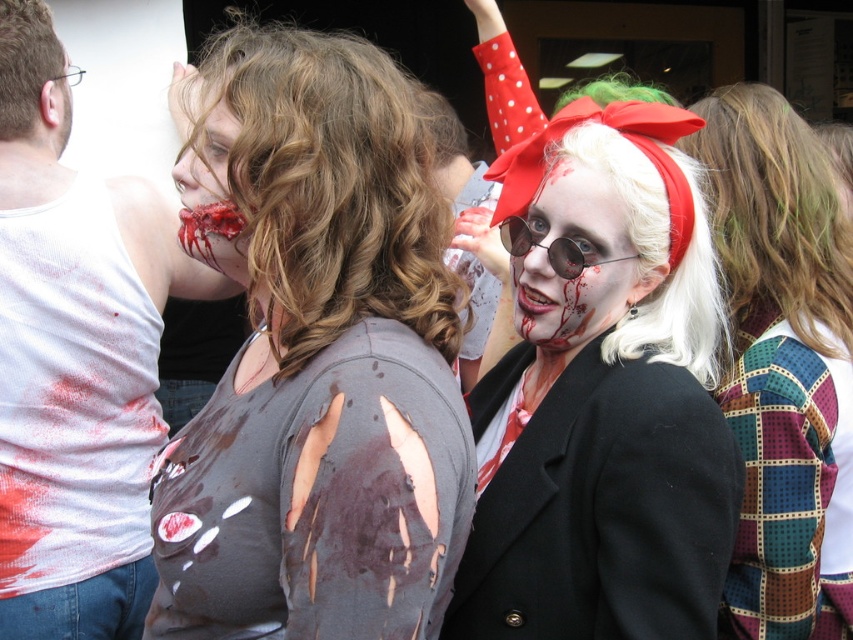
Who is more distant from viewer, (813, 472) or (509, 234)?

The point (509, 234) is more distant.

Is multicolored patchwork shirt at center positioned behind sunglasses at center?

Yes.

Between point (720, 102) and point (579, 248), which one is positioned in front?

Point (579, 248) is more forward.

The image size is (853, 640). Identify the location of multicolored patchwork shirt at center. (782, 364).

Does matte black coat at center appear on the left side of sunglasses at center?

In fact, matte black coat at center is to the right of sunglasses at center.

Is matte black coat at center positioned in front of sunglasses at center?

Yes, matte black coat at center is closer to the viewer.

Between point (593, 152) and point (579, 273), which one is positioned in front?

Point (593, 152) is more forward.

Locate an element on the screen. This screenshot has width=853, height=640. matte black coat at center is located at coordinates (602, 420).

Describe the element at coordinates (316, 358) in the screenshot. I see `ripped gray shirt at center` at that location.

Does point (155, 474) come farther from viewer compared to point (233, 129)?

That is True.

Identify the location of ripped gray shirt at center. (316, 358).